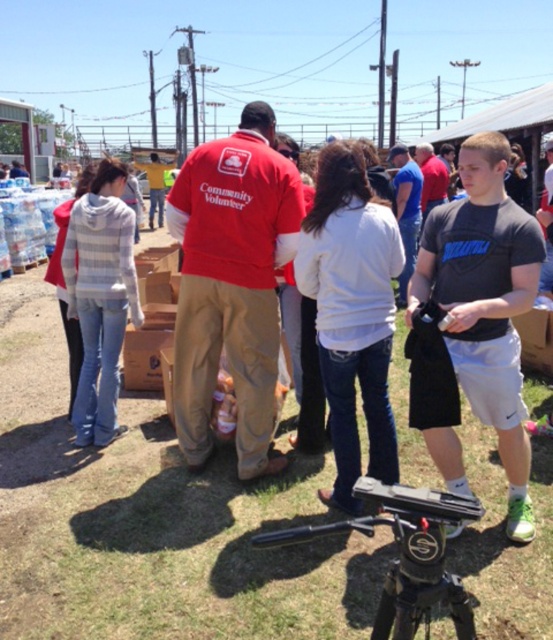
Question: From the image, what is the correct spatial relationship of white cotton shirt at center in relation to black cotton t-shirt at center?

Choices:
 (A) above
 (B) below

Answer: (A)

Question: Which object is closer to the camera taking this photo?

Choices:
 (A) black cotton t-shirt at center
 (B) striped hoodie at left
 (C) black plastic tripod at lower center
 (D) black matte tripod at lower center

Answer: (C)

Question: Is black cotton t-shirt at center bigger than black plastic tripod at lower center?

Choices:
 (A) yes
 (B) no

Answer: (A)

Question: Which of the following is the farthest from the observer?

Choices:
 (A) (248, 323)
 (B) (322, 243)

Answer: (A)

Question: Is black cotton t-shirt at center below black matte tripod at lower center?

Choices:
 (A) no
 (B) yes

Answer: (A)

Question: Which point is closer to the camera?

Choices:
 (A) (452, 577)
 (B) (295, 195)
 (C) (472, 394)
 (D) (357, 488)

Answer: (D)